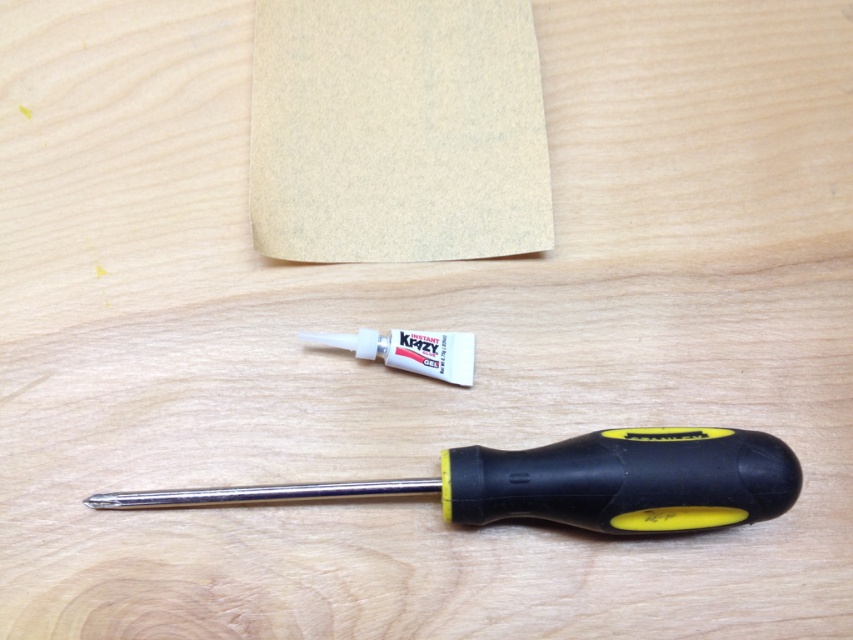
Question: Can you confirm if beige felt paper at upper center is bigger than black/yellow plastic screwdriver at lower center?

Choices:
 (A) yes
 (B) no

Answer: (B)

Question: Which of the following is the farthest from the observer?

Choices:
 (A) (614, 477)
 (B) (451, 109)

Answer: (B)

Question: Which point is closer to the camera?

Choices:
 (A) (303, 90)
 (B) (648, 432)

Answer: (B)

Question: Observing the image, what is the correct spatial positioning of beige felt paper at upper center in reference to black/yellow plastic screwdriver at lower center?

Choices:
 (A) below
 (B) above

Answer: (B)

Question: Is beige felt paper at upper center above black/yellow plastic screwdriver at lower center?

Choices:
 (A) yes
 (B) no

Answer: (A)